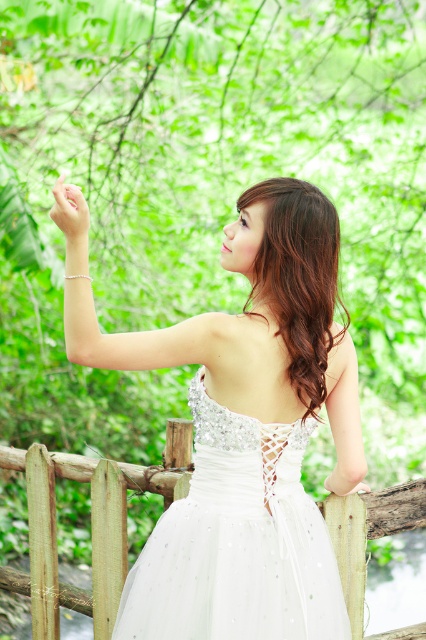
Can you confirm if white satin dress at center is positioned below white tulle dress at center?

Incorrect, white satin dress at center is not positioned below white tulle dress at center.

At what (x,y) coordinates should I click in order to perform the action: click on white satin dress at center. Please return your answer as a coordinate pair (x, y). The width and height of the screenshot is (426, 640). Looking at the image, I should click on pyautogui.click(x=250, y=419).

Between point (311, 582) and point (216, 593), which one is positioned in front?

Point (216, 593) is more forward.

Find the location of a particular element. white satin dress at center is located at coordinates (250, 419).

Is point (190, 349) farther from viewer compared to point (69, 205)?

Yes.

Does white satin dress at center have a greater width compared to pale skin at upper left?

Correct, the width of white satin dress at center exceeds that of pale skin at upper left.

The height and width of the screenshot is (640, 426). What do you see at coordinates (250, 419) in the screenshot?
I see `white satin dress at center` at bounding box center [250, 419].

Identify the location of white satin dress at center. The width and height of the screenshot is (426, 640). (250, 419).

Does white satin dress at center appear over wooden fence at center?

Yes, white satin dress at center is above wooden fence at center.

Is white satin dress at center smaller than wooden fence at center?

Yes, white satin dress at center is smaller than wooden fence at center.

The width and height of the screenshot is (426, 640). Describe the element at coordinates (250, 419) in the screenshot. I see `white satin dress at center` at that location.

This screenshot has width=426, height=640. Identify the location of white satin dress at center. (250, 419).